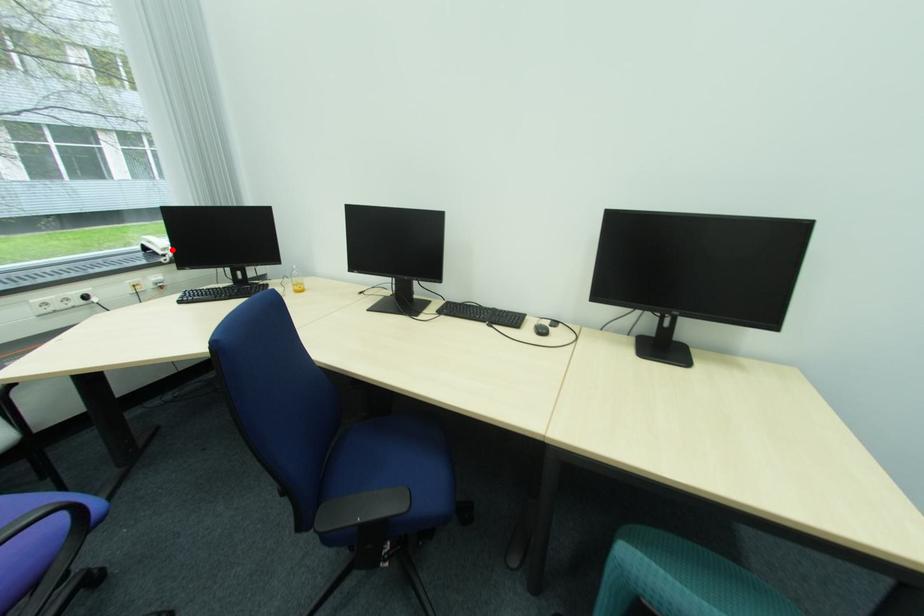
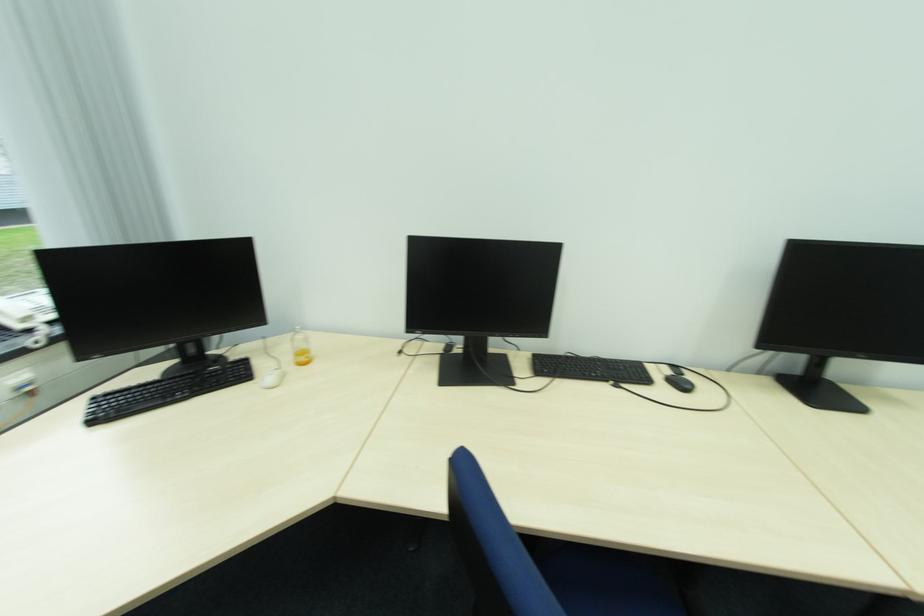
The point at the highlighted location is marked in the first image. Where is the corresponding point in the second image?

(31, 320)